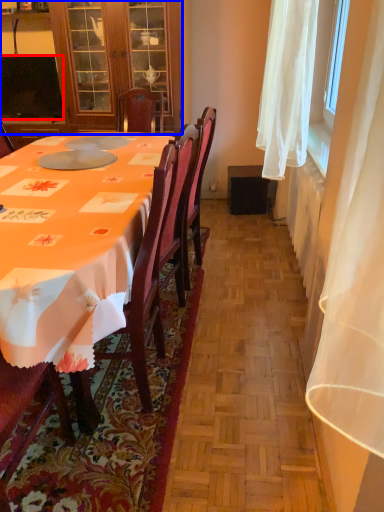
Question: Among these objects, which one is nearest to the camera, television (highlighted by a red box) or cabinetry (highlighted by a blue box)?

Choices:
 (A) television
 (B) cabinetry

Answer: (B)